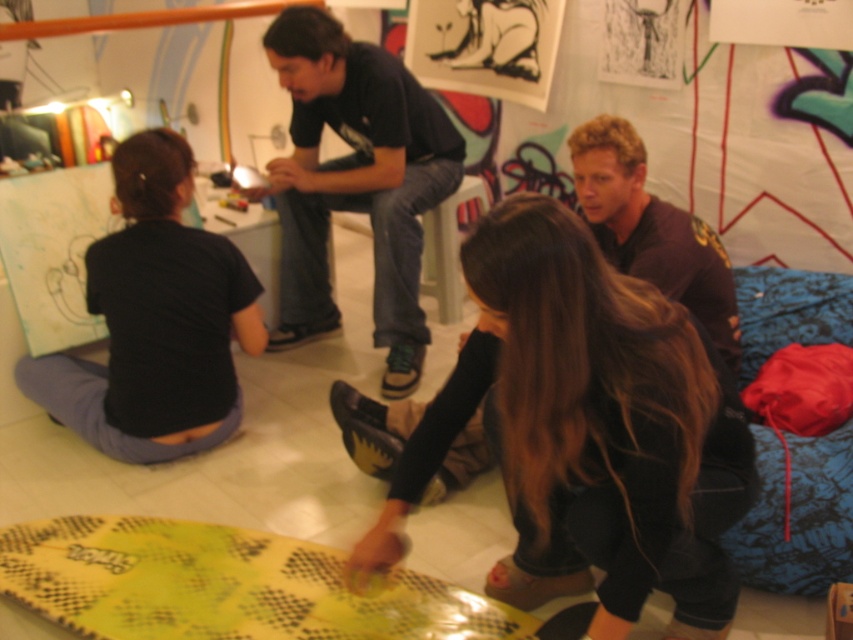
You are trying to decide whether to place a small plant between the smooth black pants at lower center and the yellow textured surfboard at lower center. Given their widths, which object should you place the plant closer to to ensure it doesn not get in the way?

Since the smooth black pants at lower center is narrower than the yellow textured surfboard at lower center, placing the plant closer to the smooth black pants at lower center would leave more space between them and the surfboard, minimizing obstruction.

You are standing in the room and want to place a small plant pot exactly where the smooth black pants at lower center are located. According to the coordinates provided, what are the exact coordinates where you should place the plant pot?

The exact coordinates where you should place the plant pot are at point [585,429], as that is the 2D location of the smooth black pants at lower center.

You are standing at the center of the room and want to pick up the yellow textured surfboard at lower center. According to the coordinates provided, in which direction should you move to reach it?

The yellow textured surfboard at lower center is located at coordinates point (225, 586). Since the x coordinate is 0.916, which is greater than 0.5, you should move to the right. The y coordinate is 0.265, which is lower than 0.5, so you should move downward. Therefore, you should move to the lower right direction to reach the yellow textured surfboard at lower center.